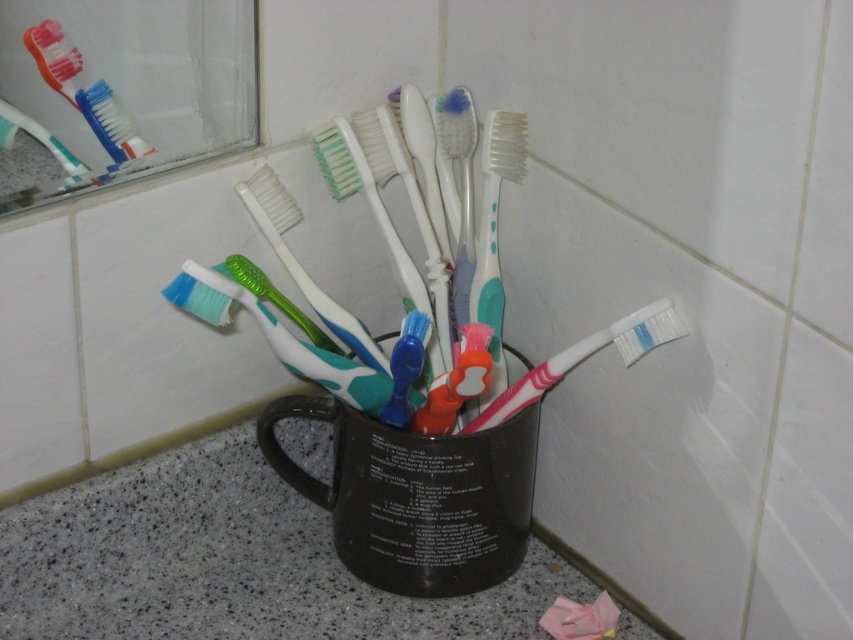
Question: Can you confirm if granite countertop at lower left is positioned to the right of pink rubber toothbrush at center?

Choices:
 (A) yes
 (B) no

Answer: (B)

Question: Can you confirm if black matte mug at center is positioned to the left of white plastic toothbrush at center?

Choices:
 (A) yes
 (B) no

Answer: (B)

Question: Which point is closer to the camera?

Choices:
 (A) (325, 301)
 (B) (370, 188)
 (C) (163, 292)

Answer: (C)

Question: Among these points, which one is farthest from the camera?

Choices:
 (A) (364, 376)
 (B) (282, 228)

Answer: (B)

Question: Which object appears farthest from the camera in this image?

Choices:
 (A) granite countertop at lower left
 (B) teal plastic toothbrush at center

Answer: (B)

Question: Considering the relative positions of green rubber toothbrush at center and matte plastic toothbrush at upper left in the image provided, where is green rubber toothbrush at center located with respect to matte plastic toothbrush at upper left?

Choices:
 (A) right
 (B) left

Answer: (A)